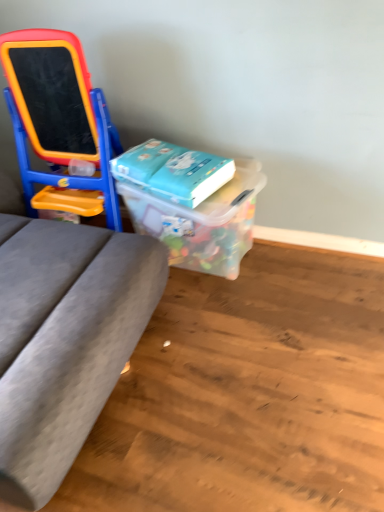
Question: Is translucent plastic container at center in front of blue matte book at center?

Choices:
 (A) no
 (B) yes

Answer: (B)

Question: Is translucent plastic container at center facing away from blue matte book at center?

Choices:
 (A) no
 (B) yes

Answer: (A)

Question: Is translucent plastic container at center facing towards blue matte book at center?

Choices:
 (A) no
 (B) yes

Answer: (A)

Question: Considering the relative positions of translucent plastic container at center and blue matte book at center in the image provided, is translucent plastic container at center to the right of blue matte book at center from the viewer's perspective?

Choices:
 (A) yes
 (B) no

Answer: (A)

Question: Is translucent plastic container at center touching blue matte book at center?

Choices:
 (A) yes
 (B) no

Answer: (B)

Question: Can we say translucent plastic container at center lies outside blue matte book at center?

Choices:
 (A) no
 (B) yes

Answer: (B)

Question: Can you confirm if blue matte book at center is smaller than translucent plastic container at center?

Choices:
 (A) yes
 (B) no

Answer: (A)

Question: From a real-world perspective, is blue matte book at center physically below translucent plastic container at center?

Choices:
 (A) yes
 (B) no

Answer: (B)

Question: Is blue matte book at center bigger than translucent plastic container at center?

Choices:
 (A) yes
 (B) no

Answer: (B)

Question: Is blue matte book at center outside of translucent plastic container at center?

Choices:
 (A) yes
 (B) no

Answer: (A)

Question: Is blue matte book at center aimed at translucent plastic container at center?

Choices:
 (A) no
 (B) yes

Answer: (A)

Question: From a real-world perspective, is blue matte book at center over translucent plastic container at center?

Choices:
 (A) no
 (B) yes

Answer: (B)

Question: Does blue matte book at center have a lesser height compared to matte plastic easel at left?

Choices:
 (A) no
 (B) yes

Answer: (B)